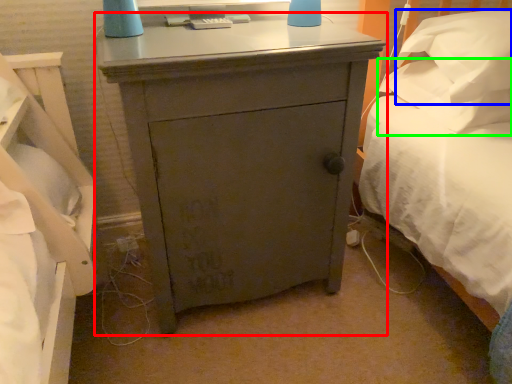
Question: Which is nearer to the nightstand (highlighted by a red box)? pillow (highlighted by a blue box) or pillow (highlighted by a green box).

Choices:
 (A) pillow
 (B) pillow

Answer: (A)